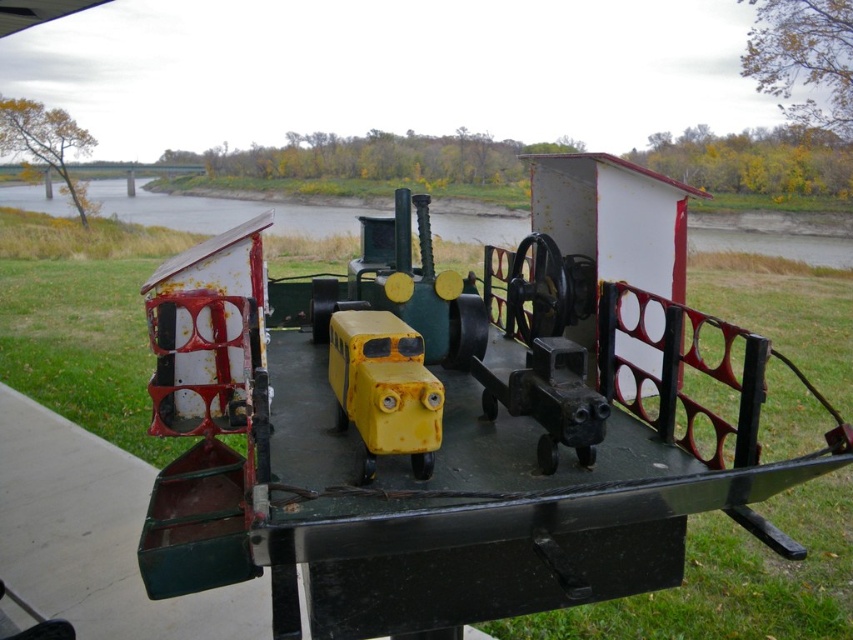
Question: From the image, what is the correct spatial relationship of rusty metal train at center in relation to yellow matte toy bus at center?

Choices:
 (A) below
 (B) above

Answer: (B)

Question: Does rusty metal train at center appear on the left side of yellow matte toy bus at center?

Choices:
 (A) no
 (B) yes

Answer: (A)

Question: Is rusty metal train at center to the left of yellow matte toy bus at center from the viewer's perspective?

Choices:
 (A) no
 (B) yes

Answer: (A)

Question: Which point is closer to the camera taking this photo?

Choices:
 (A) (384, 369)
 (B) (639, 176)

Answer: (A)